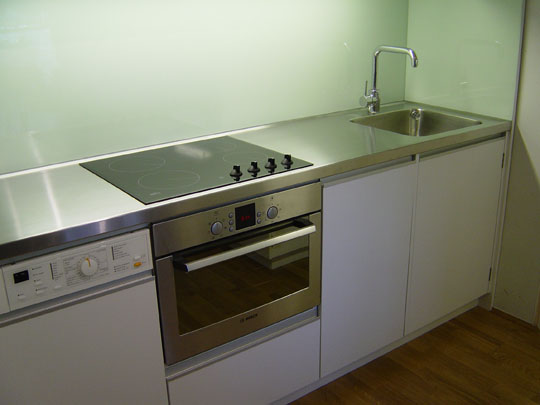
The width and height of the screenshot is (540, 405). Identify the location of knobs of the stove. (288, 159), (265, 166), (248, 167), (229, 175).